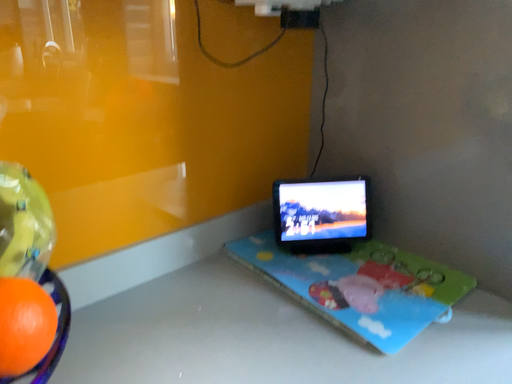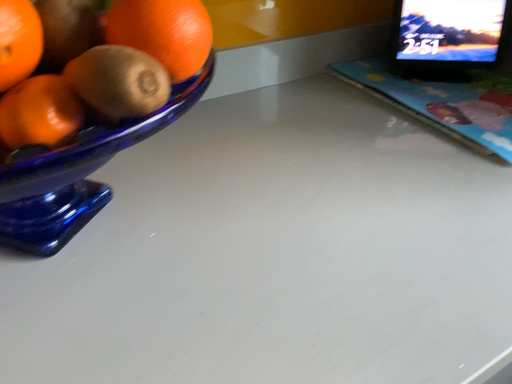
Question: Which way did the camera rotate in the video?

Choices:
 (A) rotated downward
 (B) rotated upward

Answer: (A)